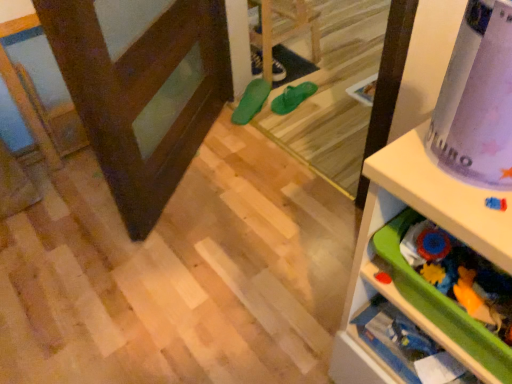
Locate an element on the screen. Image resolution: width=512 pixels, height=384 pixels. unoccupied area in front of green rubber flip-flops at center, which ranks as the 2th footwear in front-to-back order is located at coordinates (300, 120).